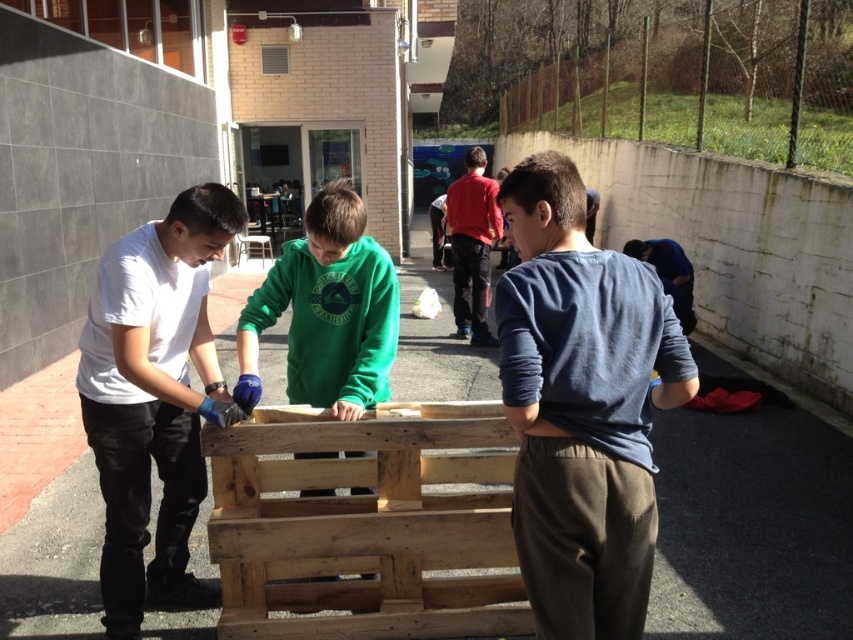
You are standing at the entrance of the alley and see the blue cotton shirt at center located at point (581,406). If you walk straight ahead, will you pass by the blue cotton shirt at center before reaching the greenery at the end?

Yes, the blue cotton shirt at center is located at point (581,406), which is closer to the entrance than the greenery at the end of the alley. Walking straight ahead, you will pass by the blue cotton shirt at center before reaching the greenery.

You are standing at the entrance of the alley and want to hand a tool to the blue cotton shirt at center. Based on their position, in which direction should you walk to reach them?

The blue cotton shirt at center is located at point 0.636 on the x and 0.682 on the y axis. Since you are at the entrance, you should walk forward along the alley towards the center area to reach them.

You are standing in the alleyway and want to reach a specific point marked at coordinates point (90,433). If your reach extends 3 feet, can you touch that point without moving closer?

The distance of point (90,433) from viewer is 9.22 feet, which is farther than your 3 feet reach. You cannot touch it without moving closer.